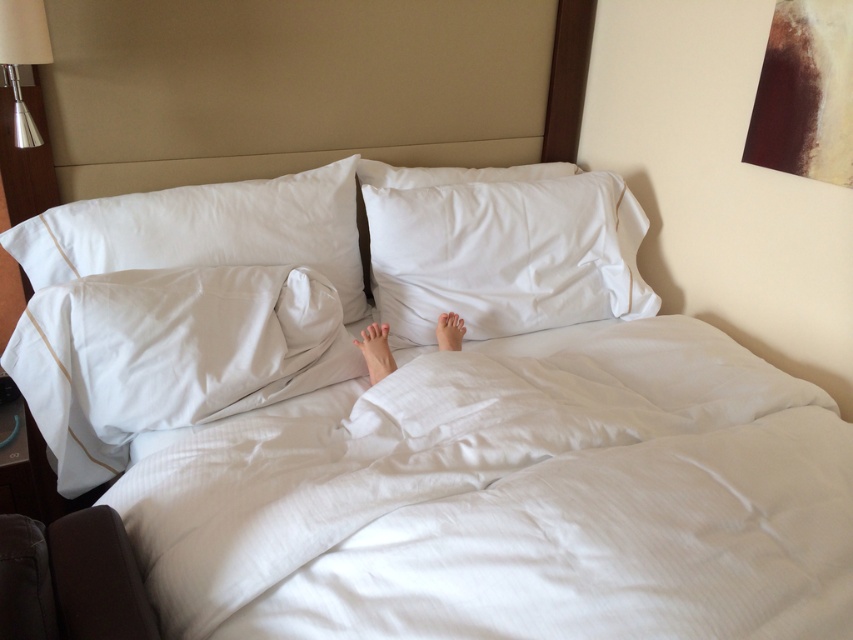
Question: Is metallic silver lampshade at upper left wider than white smooth foot at center?

Choices:
 (A) no
 (B) yes

Answer: (B)

Question: Does white textured pillow at lower left lie behind white satin pillow at upper left?

Choices:
 (A) yes
 (B) no

Answer: (B)

Question: Which is farther from the white textured pillow at lower left?

Choices:
 (A) white soft pillow at center
 (B) white smooth foot at center
 (C) white satin pillow at upper left
 (D) skinny white feet at center

Answer: (B)

Question: Is metallic silver lampshade at upper left thinner than white smooth foot at center?

Choices:
 (A) yes
 (B) no

Answer: (B)

Question: Which is nearer to the white textured sheet at center?

Choices:
 (A) matte white foot at center
 (B) white textured pillow at lower left
 (C) metallic silver lampshade at upper left

Answer: (B)

Question: Which is nearer to the white textured sheet at center?

Choices:
 (A) skinny white feet at center
 (B) metallic silver lampshade at upper left

Answer: (A)